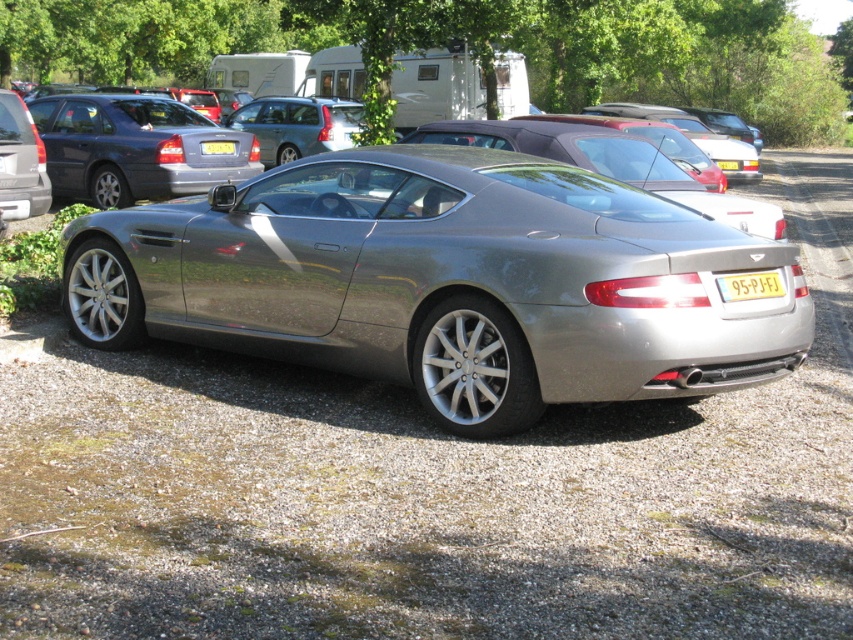
Question: Can you confirm if matte gray sedan at center is smaller than matte silver car at left?

Choices:
 (A) no
 (B) yes

Answer: (A)

Question: Can you confirm if matte silver car at left is thinner than yellow matte license plate at center?

Choices:
 (A) yes
 (B) no

Answer: (A)

Question: Which point is closer to the camera?

Choices:
 (A) (726, 296)
 (B) (229, 144)
 (C) (724, 168)

Answer: (A)

Question: Is satin silver car at center behind matte silver car at left?

Choices:
 (A) yes
 (B) no

Answer: (B)

Question: Considering the real-world distances, which object is closest to the yellow plastic license plate at center?

Choices:
 (A) yellow metallic license plate at center
 (B) satin silver car at center
 (C) matte gray sedan at center

Answer: (C)

Question: Which object is positioned farthest from the yellow matte license plate at center?

Choices:
 (A) matte silver car at left
 (B) satin silver car at center
 (C) matte gray sedan at center
 (D) yellow metallic license plate at center

Answer: (B)